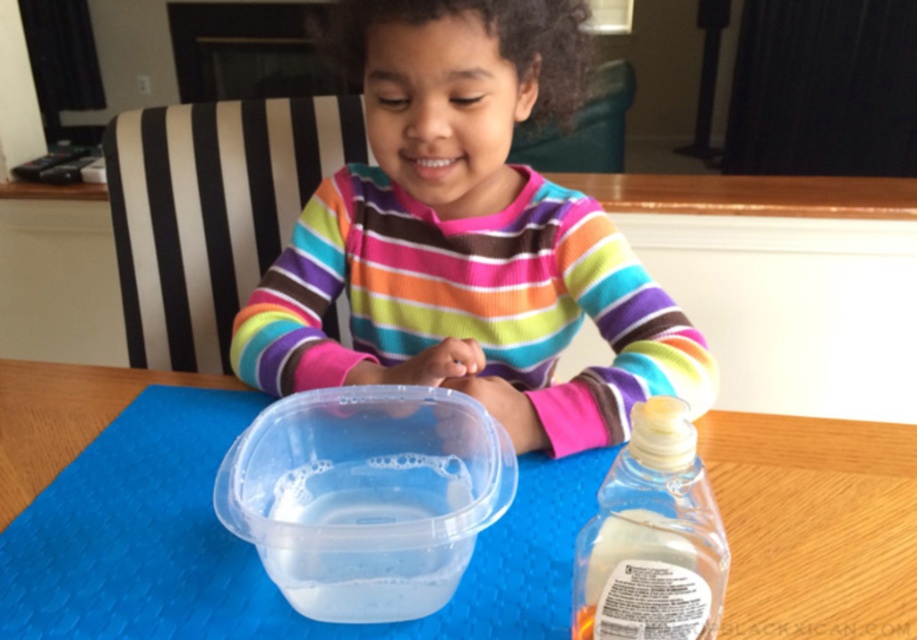
Question: Can you confirm if multicolored striped shirt at center is positioned to the right of transparent plastic water at center?

Choices:
 (A) yes
 (B) no

Answer: (A)

Question: Considering the real-world distances, which object is closest to the transparent plastic table at center?

Choices:
 (A) transparent plastic water at center
 (B) multicolored striped shirt at center
 (C) translucent plastic bottle at lower right

Answer: (A)

Question: Which object appears farthest from the camera in this image?

Choices:
 (A) transparent plastic water at center
 (B) translucent plastic bottle at lower right
 (C) transparent plastic table at center

Answer: (C)

Question: Does multicolored striped shirt at center appear on the left side of transparent plastic table at center?

Choices:
 (A) yes
 (B) no

Answer: (B)

Question: Which of the following is the closest to the observer?

Choices:
 (A) (310, 600)
 (B) (713, 595)
 (C) (435, 3)

Answer: (B)

Question: Does multicolored striped shirt at center appear under translucent plastic bottle at lower right?

Choices:
 (A) yes
 (B) no

Answer: (B)